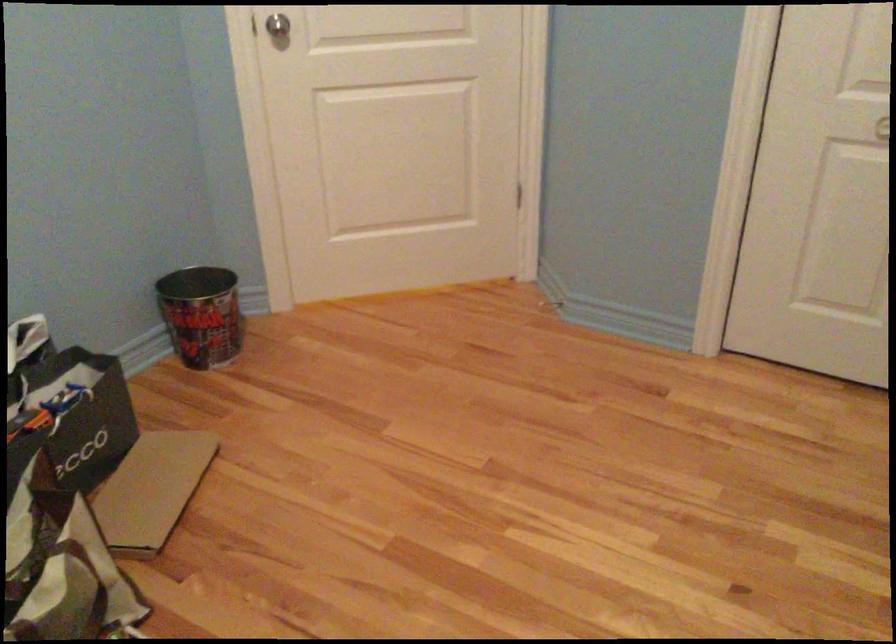
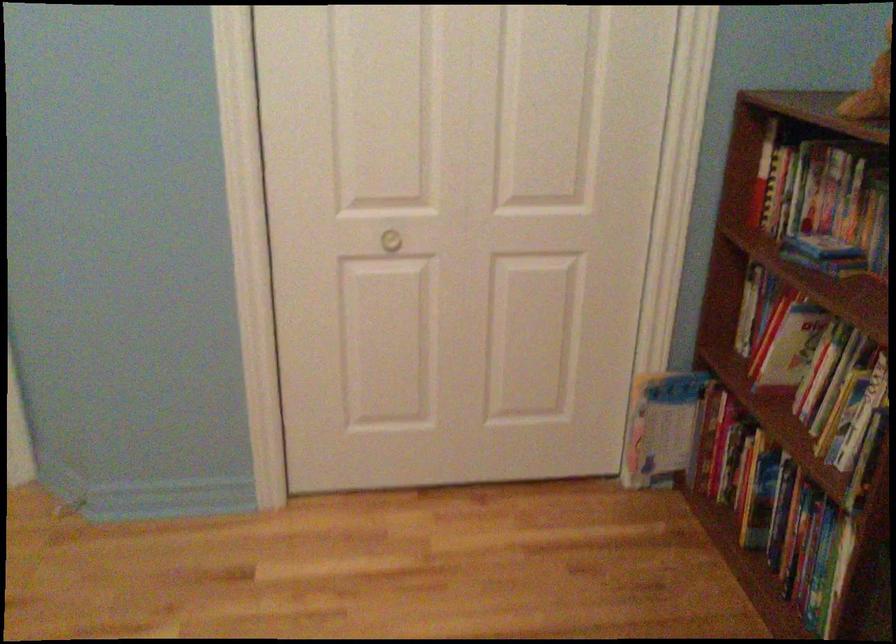
Question: Based on the continuous images, in which direction is the camera rotating? Reply with the corresponding letter.

Choices:
 (A) Left
 (B) Right
 (C) Up
 (D) Down

Answer: (B)